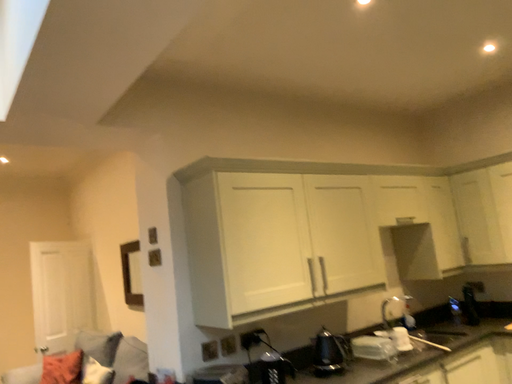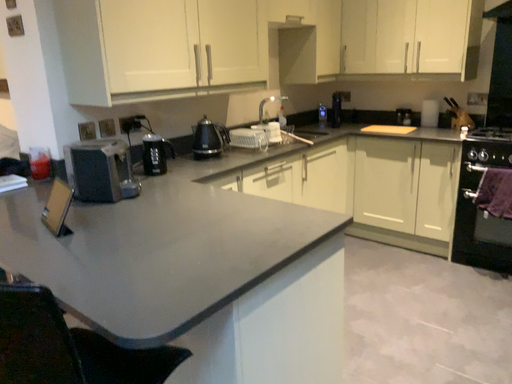
Question: How did the camera likely rotate when shooting the video?

Choices:
 (A) rotated upward
 (B) rotated downward

Answer: (B)